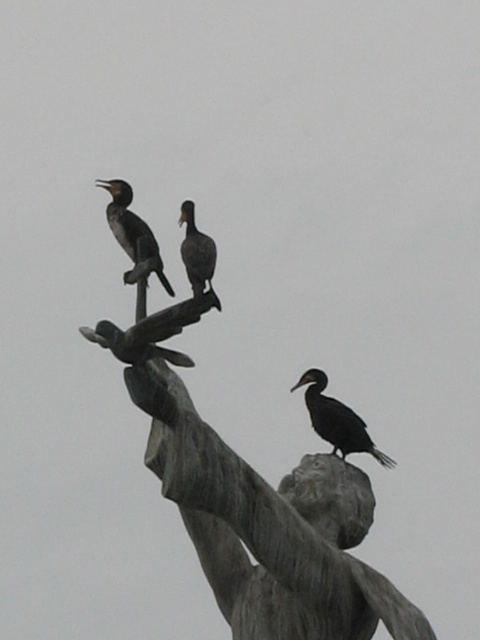
You are an ornithologist observing the bronze statue at upper center and the dark gray feathers at center in the image. Which object is positioned to the right side of the other?

The bronze statue at upper center is to the right of dark gray feathers at center, so the bronze statue at upper center is positioned to the right side of the dark gray feathers at center.

You are standing in front of the bronze statue at upper center. If you want to take a photo of the statue with the birds perched on its raised arm and head, where should you position yourself relative to the statue to ensure all the birds are visible in the frame?

Since the bronze statue at upper center is located at coordinates 0.766 on the x and 0.519 on the y, positioning yourself directly in front and slightly to the left of the statue would allow you to capture all the birds on the raised arm and head in the frame.

What is located at the coordinates point (336,419)?

The point (336,419) is on the black matte bird at center.